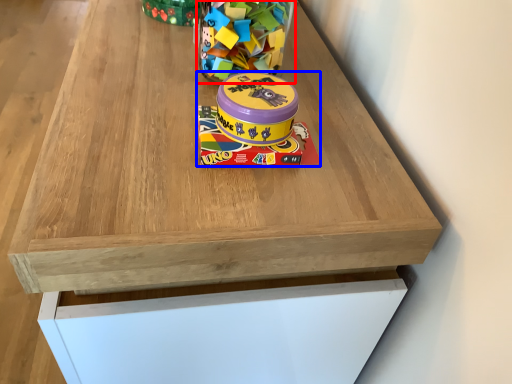
Question: Which point is further to the camera, toy (highlighted by a red box) or toy (highlighted by a blue box)?

Choices:
 (A) toy
 (B) toy

Answer: (A)